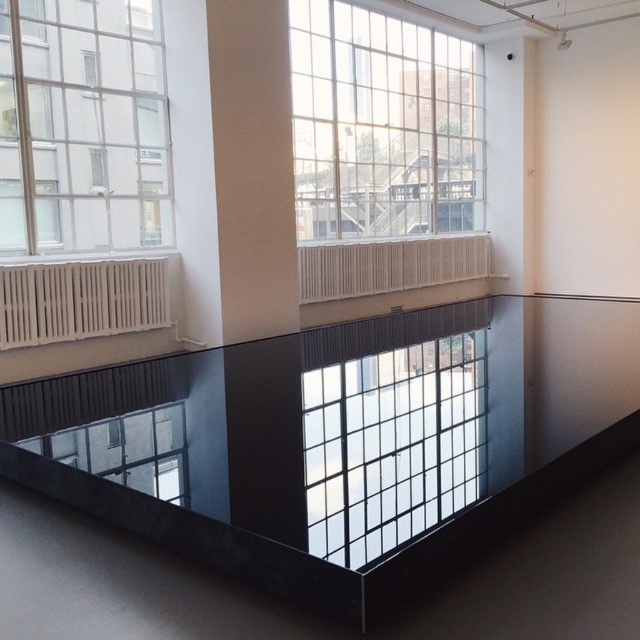
Question: Is the position of transparent glass table at center more distant than that of clear glass window at upper center?

Choices:
 (A) no
 (B) yes

Answer: (A)

Question: Considering the relative positions of clear glass window at upper left and transparent glass window at lower left in the image provided, where is clear glass window at upper left located with respect to transparent glass window at lower left?

Choices:
 (A) right
 (B) left

Answer: (B)

Question: Which point is farther from the camera taking this photo?

Choices:
 (A) (170, 432)
 (B) (84, 220)
 (C) (385, 204)
 (D) (589, 404)

Answer: (C)

Question: Which object appears farthest from the camera in this image?

Choices:
 (A) transparent glass window at center
 (B) transparent glass table at center
 (C) transparent glass window at lower left

Answer: (C)

Question: Is transparent glass table at center below transparent glass window at lower left?

Choices:
 (A) no
 (B) yes

Answer: (B)

Question: Estimate the real-world distances between objects in this image. Which object is farther from the transparent glass window at lower left?

Choices:
 (A) transparent glass window at center
 (B) clear glass window at upper left
 (C) transparent glass table at center
 (D) clear glass window at upper center

Answer: (D)